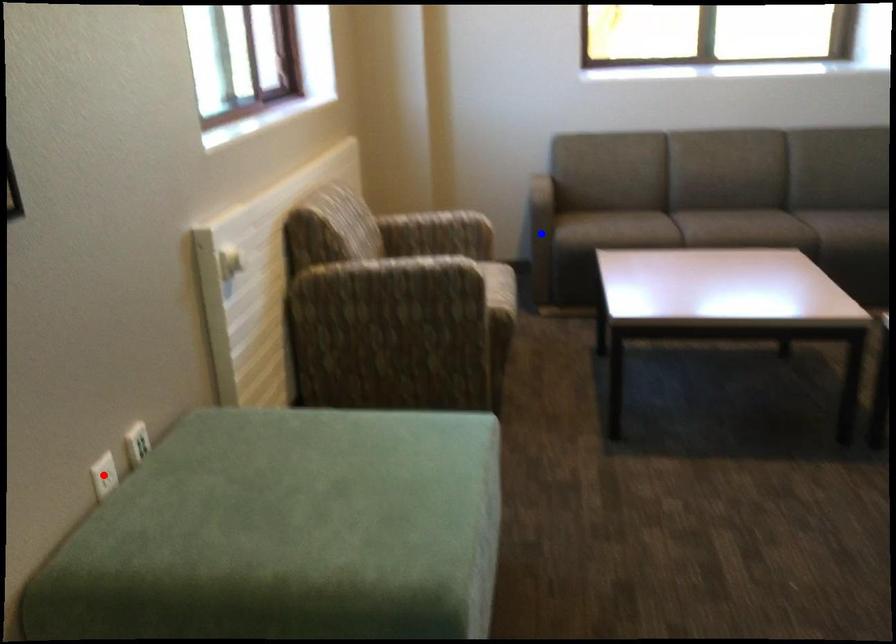
Question: In the image, two points are highlighted. Which point is nearer to the camera? Reply with the corresponding letter.

Choices:
 (A) blue point
 (B) red point

Answer: (B)